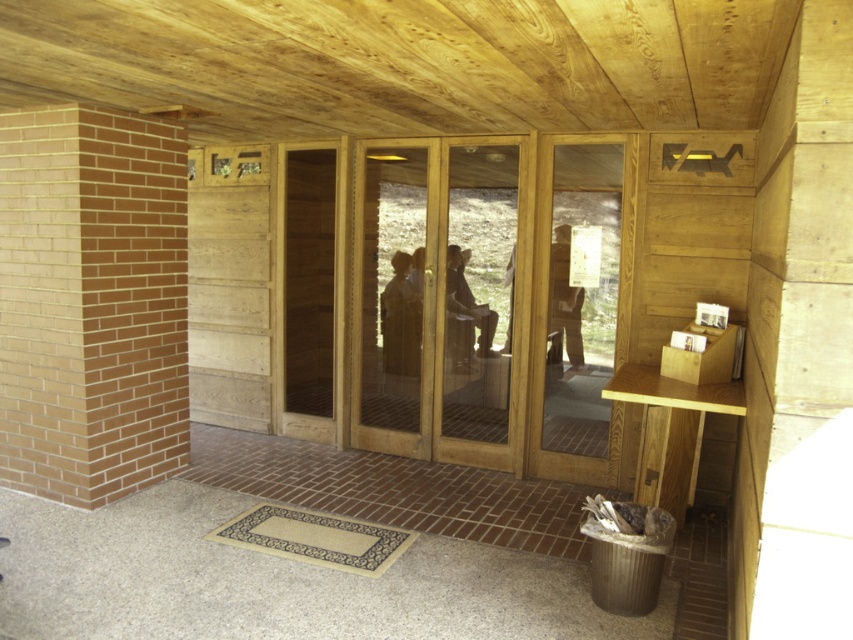
Question: Is transparent wood glass door at center to the right of leather boots at center from the viewer's perspective?

Choices:
 (A) yes
 (B) no

Answer: (B)

Question: Which object is positioned closest to the leather boots at center?

Choices:
 (A) smooth brown hair at center
 (B) smooth wooden chair at center
 (C) transparent glass door at center

Answer: (A)

Question: Which of the following is the farthest from the observer?

Choices:
 (A) (306, 241)
 (B) (577, 244)
 (C) (567, 316)
 (D) (473, 372)

Answer: (A)

Question: Considering the real-world distances, which object is closest to the leather boots at center?

Choices:
 (A) smooth brown hair at center
 (B) transparent glass door at center
 (C) transparent wood glass door at center
 (D) smooth wooden chair at center

Answer: (A)

Question: Is wooden door at center above smooth wooden chair at center?

Choices:
 (A) yes
 (B) no

Answer: (A)

Question: Is wooden door at center behind smooth brown hair at center?

Choices:
 (A) yes
 (B) no

Answer: (A)